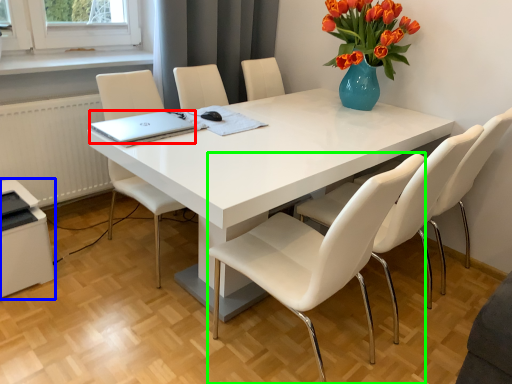
Question: Considering the real-world distances, which object is farthest from laptop (highlighted by a red box)? printer (highlighted by a blue box) or chair (highlighted by a green box)?

Choices:
 (A) printer
 (B) chair

Answer: (B)